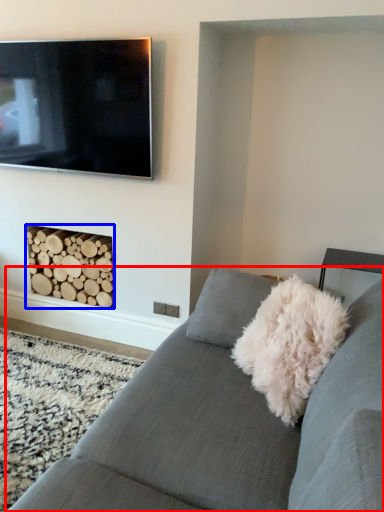
Question: Which object is closer to the camera taking this photo, studio couch (highlighted by a red box) or fireplace (highlighted by a blue box)?

Choices:
 (A) studio couch
 (B) fireplace

Answer: (A)